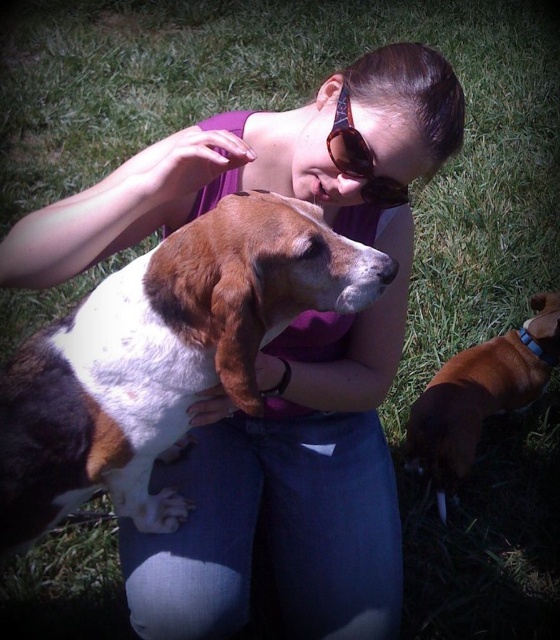
Question: Does brown and white fur dog at center appear under brown smooth dog at lower right?

Choices:
 (A) yes
 (B) no

Answer: (B)

Question: Which point is farther from the camera taking this photo?

Choices:
 (A) (367, 170)
 (B) (522, 332)

Answer: (B)

Question: Which point is closer to the camera?

Choices:
 (A) (442, 381)
 (B) (24, 404)
 (C) (352, 164)

Answer: (B)

Question: Is brown and white fur dog at center wider than sunglasses at center?

Choices:
 (A) yes
 (B) no

Answer: (A)

Question: Which point is closer to the camera?

Choices:
 (A) (67, 362)
 (B) (362, 138)
 (C) (496, 388)

Answer: (A)

Question: Can you confirm if brown smooth dog at lower right is positioned above sunglasses at center?

Choices:
 (A) yes
 (B) no

Answer: (B)